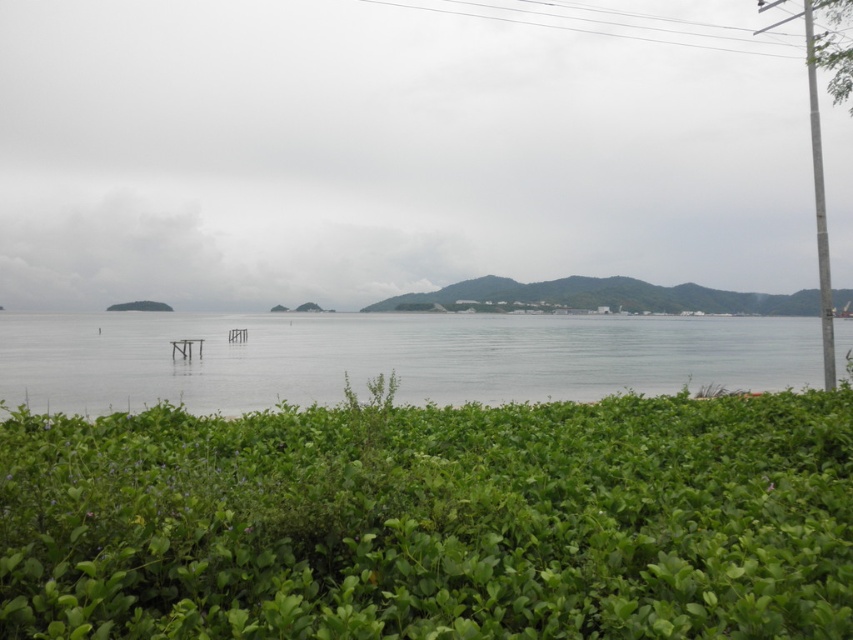
Looking at this image, you are standing at the edge of a coastal garden and want to place a 3.0 meter long wooden bench. The bench needs to be placed so that it faces the green leafy hedge at center. Is there enough space between you and the hedge to place the bench?

The distance between you and the green leafy hedge at center is 2.90 meters. Since the bench is 3.0 meters long, it would not fit as the available space is slightly shorter than the bench.

You are a landscape architect designing a pathway between the green leafy hedge at center and the metallic pole at right. Which object should you place the pathway closer to if you want to avoid making the pathway too long? Please explain your reasoning based on their sizes.

The green leafy hedge at center is smaller than the metallic pole at right. To avoid a long pathway, place it closer to the smaller object, the green leafy hedge at center, since shorter pathways are needed for smaller features to maintain balance.